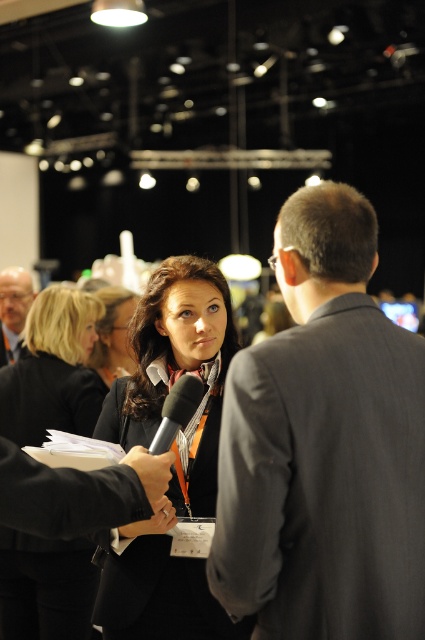
You are at the event and want to approach the person in the matte black suit at left. Based on their position, which direction should you move relative to your current position?

The matte black suit at left is located at point 0.487 on the x and 0.031 on the y coordinate, so you should move to the left and slightly forward to reach them.

You are standing in the conference room and want to locate the black fabric jacket at center. Which direction should you look to find it?

The black fabric jacket at center is located at point coordinates 0.580 on the x axis and 0.125 on the y axis, so you should look towards the center right and slightly lower part of the scene.

You are attending a conference and need to approach the speaker. The speaker is wearing a black fabric jacket at center and is talking to someone in a matte black suit at left. Which one should you approach first if you want to speak to the speaker?

The black fabric jacket at center is in front of the matte black suit at left, so you should approach the speaker wearing the black fabric jacket at center first as they are closer and more accessible.